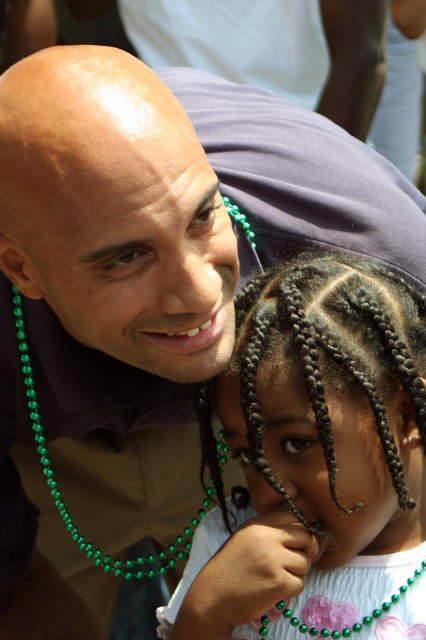
Question: Which of the following is the closest to the observer?

Choices:
 (A) dark brown braided hair at center
 (B) green beaded necklace at left
 (C) green pearl necklace at lower center

Answer: (A)

Question: Among these objects, which one is farthest from the camera?

Choices:
 (A) green pearl necklace at lower center
 (B) dark brown braided hair at center
 (C) green beaded necklace at left

Answer: (C)

Question: Does green beaded necklace at left have a greater width compared to green pearl necklace at lower center?

Choices:
 (A) no
 (B) yes

Answer: (B)

Question: Does green beaded necklace at left appear on the left side of green pearl necklace at lower center?

Choices:
 (A) yes
 (B) no

Answer: (A)

Question: Is dark brown braided hair at center below green beaded necklace at left?

Choices:
 (A) yes
 (B) no

Answer: (B)

Question: Based on their relative distances, which object is nearer to the dark brown braided hair at center?

Choices:
 (A) green beaded necklace at left
 (B) green pearl necklace at lower center

Answer: (B)